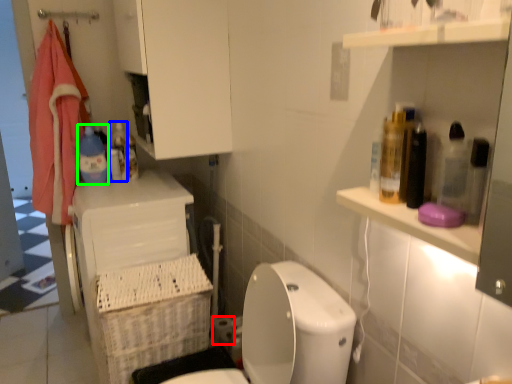
Question: Considering the real-world distances, which object is closest to toilet paper (highlighted by a red box)? bottle (highlighted by a blue box) or cleaning product (highlighted by a green box).

Choices:
 (A) bottle
 (B) cleaning product

Answer: (A)